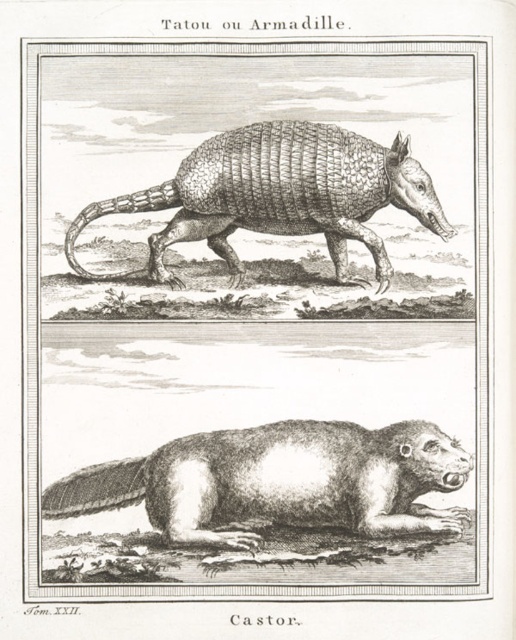
You are an explorer in the forest and see the white fur beaver at lower center and the gray textured armadillo at upper center. Which animal is positioned higher in the image?

The gray textured armadillo at upper center is positioned higher in the image than the white fur beaver at lower center.

Based on the photo, based on the engraving, where exactly is the white fur beaver at lower center located?

The white fur beaver at lower center is located at point (x=280, y=481).

In the historical engraving, you see a white fur beaver at lower center and a gray textured armadillo at upper center. Which animal appears wider in the image?

The white fur beaver at lower center appears wider than the gray textured armadillo at upper center.